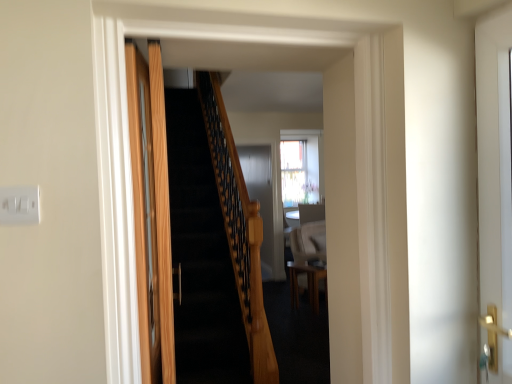
Question: Considering their positions, is white glossy door at right, arranged as the 2th door when viewed from the left, located in front of or behind wooden door at left, the 2th door positioned from the right?

Choices:
 (A) behind
 (B) front

Answer: (A)

Question: Does point (505, 226) appear closer or farther from the camera than point (159, 160)?

Choices:
 (A) farther
 (B) closer

Answer: (B)

Question: Which object is positioned closest to the white plastic/light switch at upper left?

Choices:
 (A) wooden door at left, which is the 1th door from left to right
 (B) wooden table at center
 (C) white glossy door at right, arranged as the 2th door when viewed from the left

Answer: (A)

Question: Which of these objects is positioned closest to the white glossy door at right, arranged as the 2th door when viewed from the left?

Choices:
 (A) wooden door at left, which is the 1th door from left to right
 (B) white plastic/light switch at upper left
 (C) wooden table at center

Answer: (A)